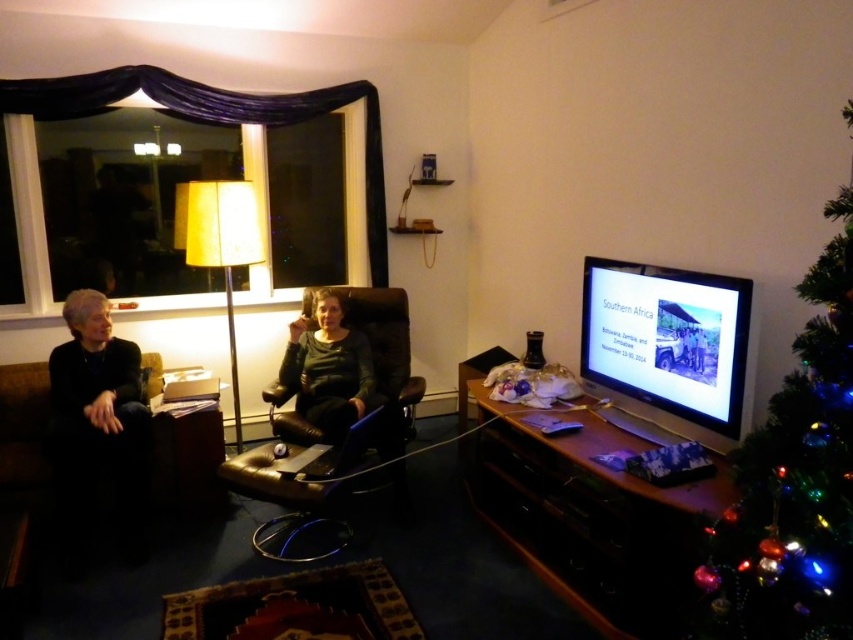
Is green artificial christmas tree at right below black leather couch at left?

Actually, green artificial christmas tree at right is above black leather couch at left.

Which is below, green artificial christmas tree at right or black leather couch at left?

Positioned lower is black leather couch at left.

Is point (793, 406) closer to viewer compared to point (68, 358)?

Yes, point (793, 406) is in front of point (68, 358).

What are the coordinates of `green artificial christmas tree at right` in the screenshot? It's located at (793, 483).

Does green artificial christmas tree at right appear over matte black chair at center?

No, green artificial christmas tree at right is not above matte black chair at center.

Which is in front, point (775, 449) or point (344, 392)?

Point (775, 449) is more forward.

Which is behind, point (790, 544) or point (322, 426)?

The point (322, 426) is behind.

You are a GUI agent. You are given a task and a screenshot of the screen. Output one action in this format:
    pyautogui.click(x=<x>, y=<y>)
    Task: Click on the green artificial christmas tree at right
    The image size is (853, 640).
    Given the screenshot: What is the action you would take?
    pyautogui.click(x=793, y=483)

Is black leather couch at left to the right of matte black chair at center from the viewer's perspective?

No, black leather couch at left is not to the right of matte black chair at center.

Is point (137, 497) farther from viewer compared to point (297, 349)?

No.

Does point (86, 381) lie behind point (305, 385)?

No.

Where is `black leather couch at left`? black leather couch at left is located at coordinates (97, 422).